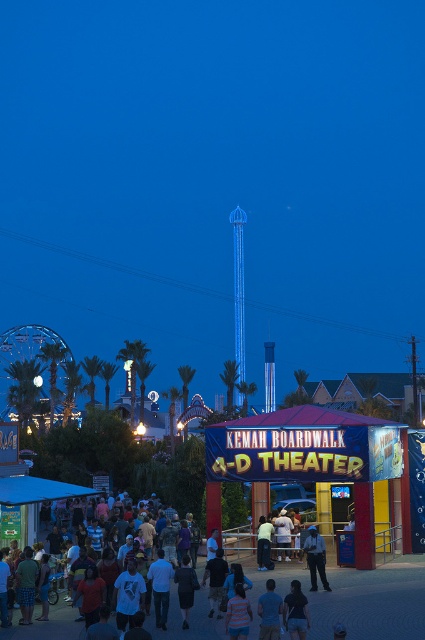
Can you confirm if dark blue shirt at center is positioned to the left of dark blue jeans at center?

Yes, dark blue shirt at center is to the left of dark blue jeans at center.

Which is in front, point (153, 636) or point (320, 568)?

Point (153, 636) is in front.

At what (x,y) coordinates should I click in order to perform the action: click on dark blue shirt at center. Please return your answer as a coordinate pair (x, y). This screenshot has width=425, height=640. Looking at the image, I should click on (189, 620).